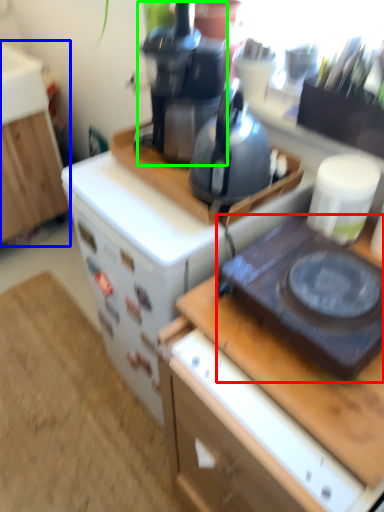
Question: Which object is the closest to the gas stove (highlighted by a red box)? Choose among these: cabinetry (highlighted by a blue box) or coffeepot (highlighted by a green box).

Choices:
 (A) cabinetry
 (B) coffeepot

Answer: (B)